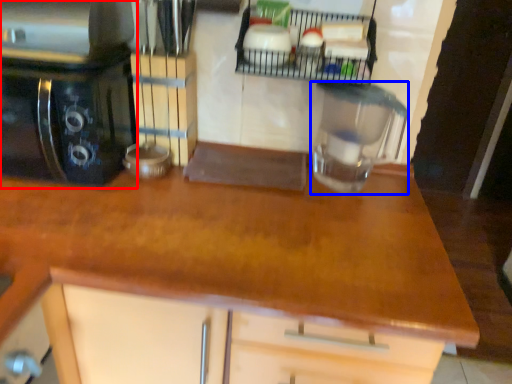
Question: Which point is further to the camera, home appliance (highlighted by a red box) or kitchen appliance (highlighted by a blue box)?

Choices:
 (A) home appliance
 (B) kitchen appliance

Answer: (B)